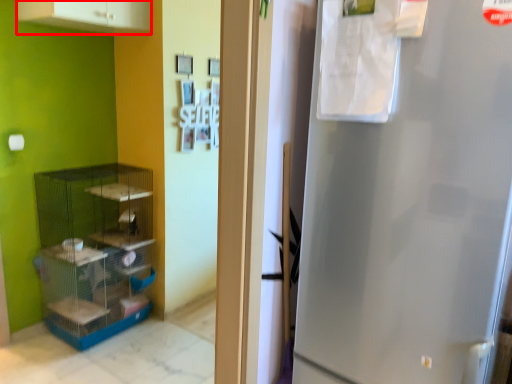
Question: From the image, what is the correct spatial relationship of cabinetry (annotated by the red box) in relation to shelf?

Choices:
 (A) left
 (B) right

Answer: (B)